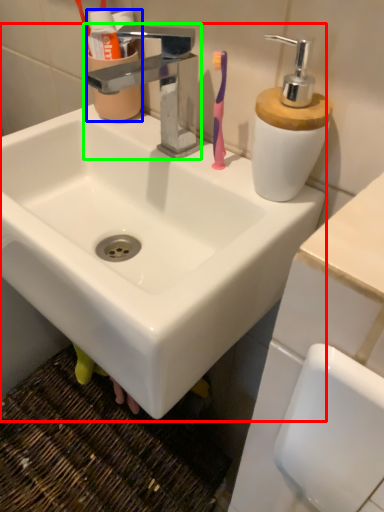
Question: Which object is positioned closest to sink (highlighted by a red box)? Select from mouthwash (highlighted by a blue box) and tap (highlighted by a green box).

Choices:
 (A) mouthwash
 (B) tap

Answer: (B)